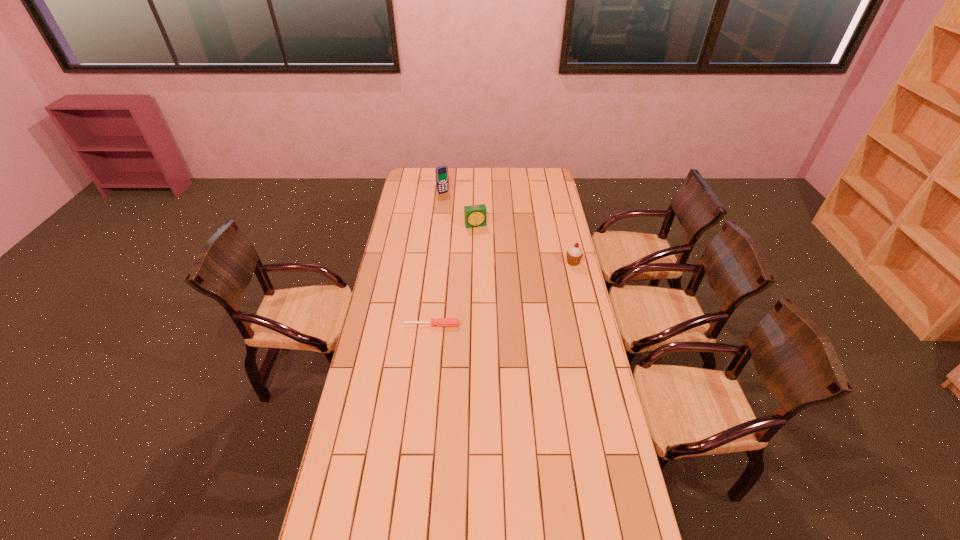
Locate an element on the screen. Image resolution: width=960 pixels, height=540 pixels. vacant space that's between the third farthest object and the alarm clock is located at coordinates (524, 244).

Where is `vacant area between the second object from right to left and the tallest object`? vacant area between the second object from right to left and the tallest object is located at coordinates click(460, 208).

The height and width of the screenshot is (540, 960). I want to click on vacant region between the cupcake and the alarm clock, so click(524, 244).

Point out which object is positioned as the nearest to the cellular telephone. Please provide its 2D coordinates. Your answer should be formatted as a tuple, i.e. [(x, y)], where the tuple contains the x and y coordinates of a point satisfying the conditions above.

[(474, 215)]

Point out which object is positioned as the second nearest to the screwdriver. Please provide its 2D coordinates. Your answer should be formatted as a tuple, i.e. [(x, y)], where the tuple contains the x and y coordinates of a point satisfying the conditions above.

[(474, 215)]

Where is `vacant point that satisfies the following two spatial constraints: 1. on the front side of the second nearest object; 2. on the right side of the tallest object`? This screenshot has width=960, height=540. vacant point that satisfies the following two spatial constraints: 1. on the front side of the second nearest object; 2. on the right side of the tallest object is located at coordinates (435, 262).